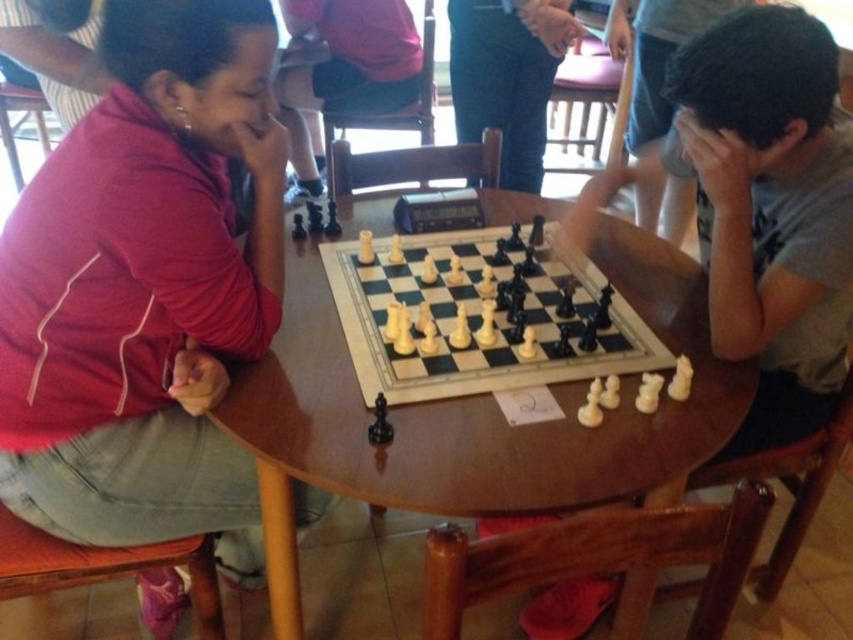
Is matte red shirt at upper left closer to camera compared to matte black chess piece at upper center?

Yes, it is.

Who is positioned more to the right, matte red shirt at upper left or matte black chess piece at upper center?

Positioned to the right is matte black chess piece at upper center.

Find the location of a particular element. matte red shirt at upper left is located at coordinates (144, 284).

Who is taller, wooden table at center or white plastic chess pieces at center?

Standing taller between the two is wooden table at center.

Identify the location of wooden table at center. The width and height of the screenshot is (853, 640). (474, 419).

Does point (140, 355) lie behind point (778, 257)?

That is False.

Locate an element on the screen. The width and height of the screenshot is (853, 640). matte red shirt at upper left is located at coordinates (144, 284).